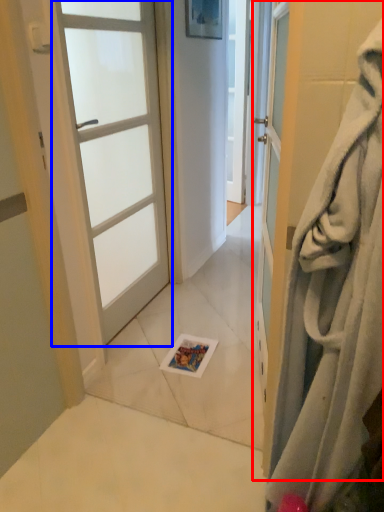
Question: Which of the following is the closest to the observer, door (highlighted by a red box) or door (highlighted by a blue box)?

Choices:
 (A) door
 (B) door

Answer: (A)